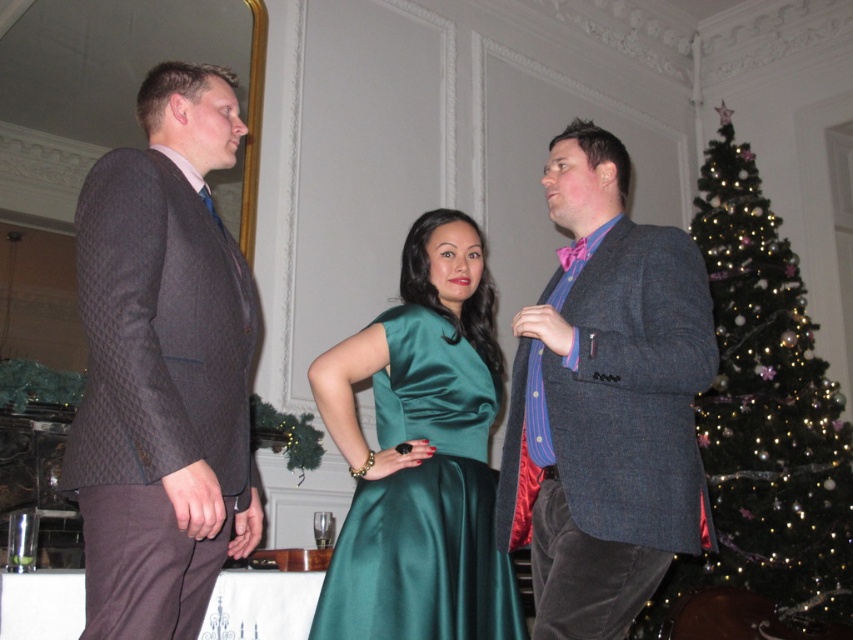
Between matte black suit at left and dark brown textured suit at left, which one is positioned higher?

dark brown textured suit at left is higher up.

Can you confirm if matte black suit at left is shorter than dark brown textured suit at left?

No, matte black suit at left is not shorter than dark brown textured suit at left.

Who is more distant from viewer, (175, 433) or (96, 436)?

Positioned behind is point (96, 436).

You are a GUI agent. You are given a task and a screenshot of the screen. Output one action in this format:
    pyautogui.click(x=<x>, y=<y>)
    Task: Click on the matte black suit at left
    The width and height of the screenshot is (853, 640).
    Given the screenshot: What is the action you would take?
    coord(161,369)

Between matte black suit at left and textured gray blazer at center, which one has less height?

textured gray blazer at center is shorter.

Is matte black suit at left bigger than textured gray blazer at center?

Yes, matte black suit at left is bigger than textured gray blazer at center.

The height and width of the screenshot is (640, 853). In order to click on matte black suit at left in this screenshot , I will do pos(161,369).

Find the location of a particular element. The height and width of the screenshot is (640, 853). matte black suit at left is located at coordinates (161, 369).

Can you confirm if dark brown textured suit at left is positioned above satin green dress at center?

Correct, dark brown textured suit at left is located above satin green dress at center.

In the scene shown: Who is lower down, dark brown textured suit at left or satin green dress at center?

Positioned lower is satin green dress at center.

Between point (157, 582) and point (453, 460), which one is positioned behind?

Positioned behind is point (453, 460).

In order to click on dark brown textured suit at left in this screenshot , I will do `click(163, 365)`.